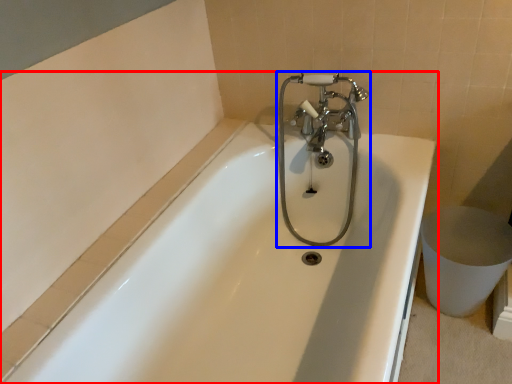
Question: Among these objects, which one is farthest to the camera, bathtub (highlighted by a red box) or tap (highlighted by a blue box)?

Choices:
 (A) bathtub
 (B) tap

Answer: (B)